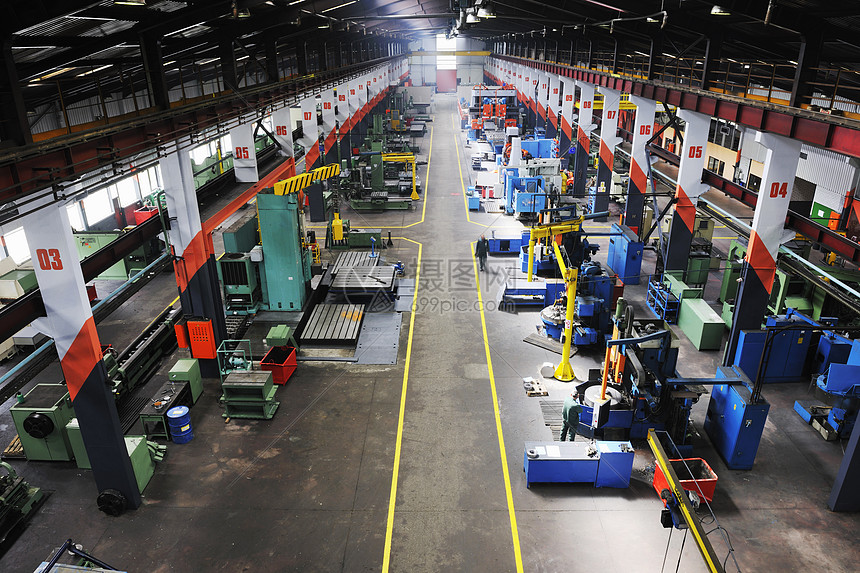
Locate an element on the screen. entrance is located at coordinates (806, 197).